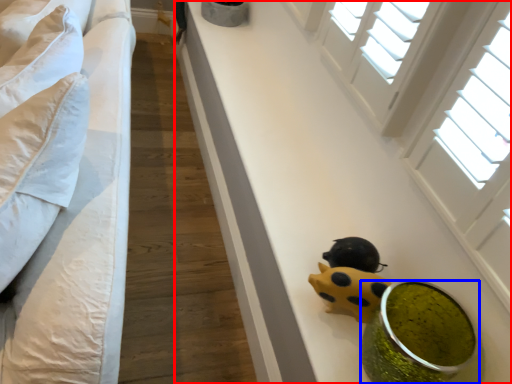
Question: Which of the following is the farthest to the observer, table (highlighted by a red box) or food (highlighted by a blue box)?

Choices:
 (A) table
 (B) food

Answer: (A)